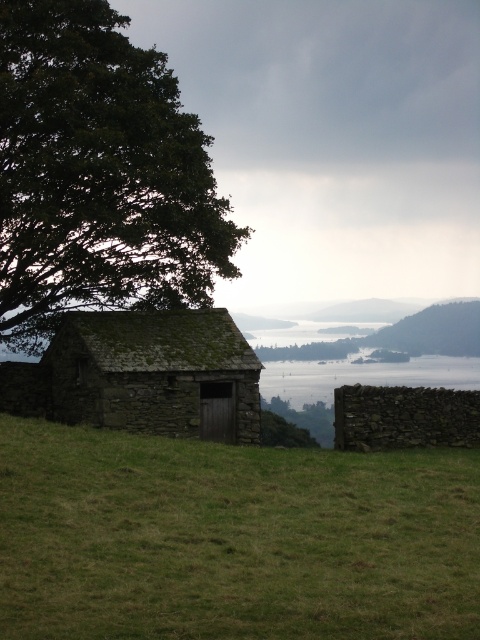
Looking at this image, you are standing at the point marked by coordinates point (231, 538) in the image. What type of terrain are you currently standing on?

The point (231, 538) marks green grassy field at lower center, so you are standing on a green grassy field.

You are standing in front of the rustic stone building and want to know which tree is nearer to you. The trees you can see are the dark green leafy tree at upper left and the green mossy tree at upper center. Which one is closer?

The dark green leafy tree at upper left is closer to the viewer than the green mossy tree at upper center.